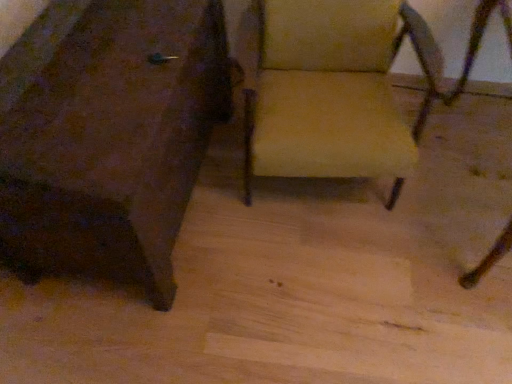
Question: Should I look upward or downward to see matte brown chair at center, which ranks as the 2th chair in right-to-left order?

Choices:
 (A) up
 (B) down

Answer: (A)

Question: Is matte brown chair at center, the 1th chair in the left-to-right sequence, inside beige fabric chair at center, which is the second chair in left-to-right order?

Choices:
 (A) no
 (B) yes

Answer: (A)

Question: Considering the relative positions of beige fabric chair at center, which is counted as the first chair, starting from the right, and matte brown chair at center, which ranks as the 2th chair in right-to-left order, in the image provided, is beige fabric chair at center, which is counted as the first chair, starting from the right, to the left of matte brown chair at center, which ranks as the 2th chair in right-to-left order, from the viewer's perspective?

Choices:
 (A) yes
 (B) no

Answer: (B)

Question: Can you confirm if beige fabric chair at center, which is counted as the first chair, starting from the right, is positioned to the right of matte brown chair at center, which ranks as the 2th chair in right-to-left order?

Choices:
 (A) no
 (B) yes

Answer: (B)

Question: Is beige fabric chair at center, which is the second chair in left-to-right order, thinner than matte brown chair at center, the 1th chair in the left-to-right sequence?

Choices:
 (A) no
 (B) yes

Answer: (B)

Question: Would you say beige fabric chair at center, which is the second chair in left-to-right order, is outside matte brown chair at center, the 1th chair in the left-to-right sequence?

Choices:
 (A) yes
 (B) no

Answer: (A)

Question: Can you see beige fabric chair at center, which is counted as the first chair, starting from the right, touching matte brown chair at center, which ranks as the 2th chair in right-to-left order?

Choices:
 (A) no
 (B) yes

Answer: (A)

Question: Does matte brown chair at center, which ranks as the 2th chair in right-to-left order, come in front of beige fabric chair at center, which is the second chair in left-to-right order?

Choices:
 (A) yes
 (B) no

Answer: (A)

Question: Can you confirm if matte brown chair at center, the 1th chair in the left-to-right sequence, is taller than beige fabric chair at center, which is counted as the first chair, starting from the right?

Choices:
 (A) no
 (B) yes

Answer: (A)

Question: Does matte brown chair at center, which ranks as the 2th chair in right-to-left order, have a lesser height compared to beige fabric chair at center, which is the second chair in left-to-right order?

Choices:
 (A) no
 (B) yes

Answer: (B)

Question: Can you confirm if matte brown chair at center, which ranks as the 2th chair in right-to-left order, is wider than beige fabric chair at center, which is counted as the first chair, starting from the right?

Choices:
 (A) no
 (B) yes

Answer: (B)

Question: Is matte brown chair at center, which ranks as the 2th chair in right-to-left order, far away from beige fabric chair at center, which is counted as the first chair, starting from the right?

Choices:
 (A) yes
 (B) no

Answer: (B)

Question: Is matte brown chair at center, the 1th chair in the left-to-right sequence, surrounding beige fabric chair at center, which is the second chair in left-to-right order?

Choices:
 (A) no
 (B) yes

Answer: (A)

Question: In terms of size, does matte brown chair at center, the 1th chair in the left-to-right sequence, appear bigger or smaller than beige fabric chair at center, which is the second chair in left-to-right order?

Choices:
 (A) small
 (B) big

Answer: (B)